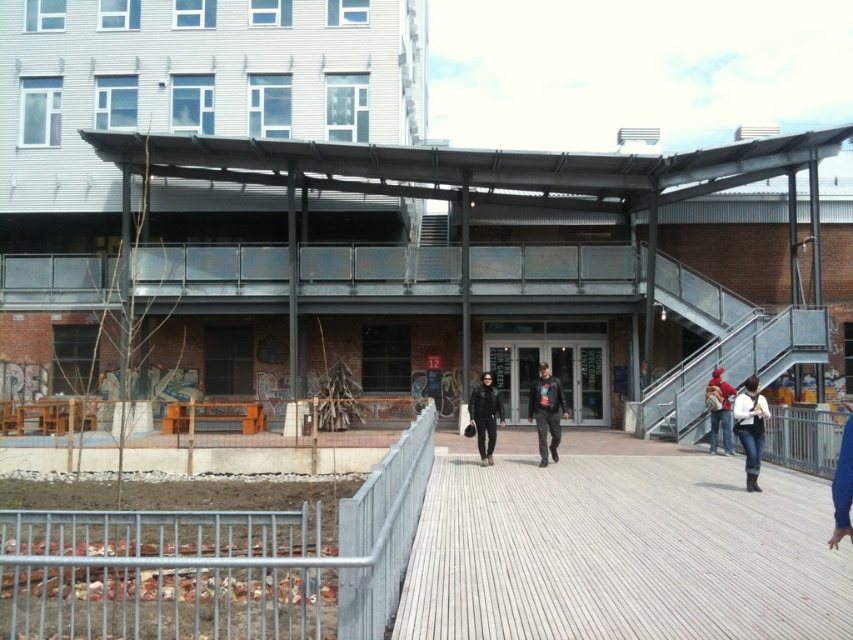
You are a delivery person trying to locate the entrance to the modern building. You see a white matte jacket at lower right and a matte red backpack at center. Which object is closer to the entrance?

The white matte jacket at lower right is closer to the entrance than the matte red backpack at center because it is positioned lower, which typically indicates proximity in such scenes.

You are a delivery person carrying a heavy package and need to walk through the area shown in the image. There are wooden planks at center and a black leather jacket at center in your path. Which object should you avoid stepping on to ensure safe passage?

You should avoid stepping on the wooden planks at center because they are in front of the black leather jacket at center, meaning they are closer to your path and might be unstable or part of construction materials.